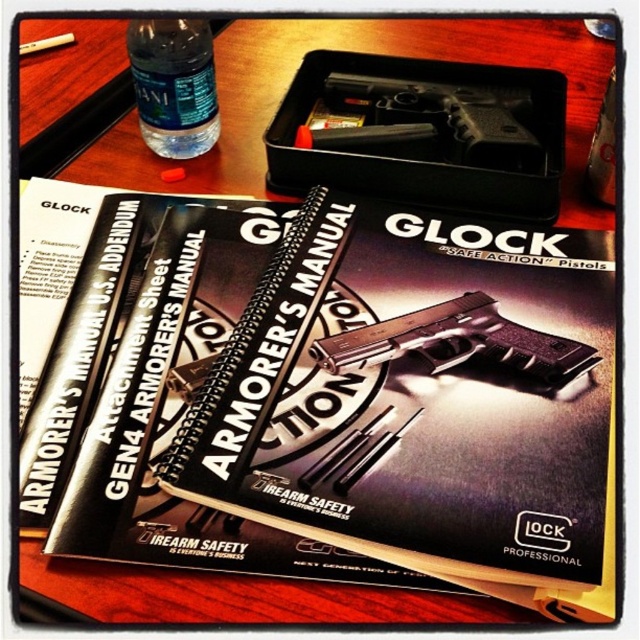
You are a safety instructor preparing a demonstration. You have a black plastic handgun at center and a clear plastic bottle at upper left on the table. Where is the black plastic handgun located in relation to the clear plastic bottle?

The black plastic handgun at center is positioned under the clear plastic bottle at upper left.

You are a safety inspector checking the layout of items on a table. You need to ensure that the clear plastic bottle at upper left is visible above the black plastic handgun at center. Is the current arrangement compliant with this requirement?

The black plastic handgun at center is taller than clear plastic bottle at upper left, so the handgun would block the view of the bottle. The arrangement is not compliant with the requirement.